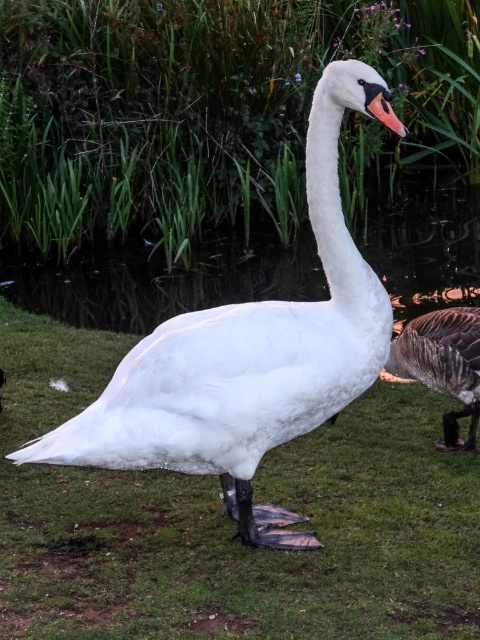
Question: Is white matte grass at center bigger than gray matte duck at right?

Choices:
 (A) no
 (B) yes

Answer: (B)

Question: Which point is closer to the camera taking this photo?

Choices:
 (A) (474, 340)
 (B) (172, 401)
 (C) (186, 630)
 (D) (376, 97)

Answer: (C)

Question: Does white matte grass at center have a lesser width compared to gray matte duck at right?

Choices:
 (A) yes
 (B) no

Answer: (B)

Question: Can you confirm if white glossy swan at center is bigger than orange glossy beak at center?

Choices:
 (A) no
 (B) yes

Answer: (B)

Question: Which object is closer to the camera taking this photo?

Choices:
 (A) white matte grass at center
 (B) orange glossy beak at center

Answer: (B)

Question: Which point is farther to the camera?

Choices:
 (A) (453, 608)
 (B) (441, 323)
 (C) (396, 120)

Answer: (B)